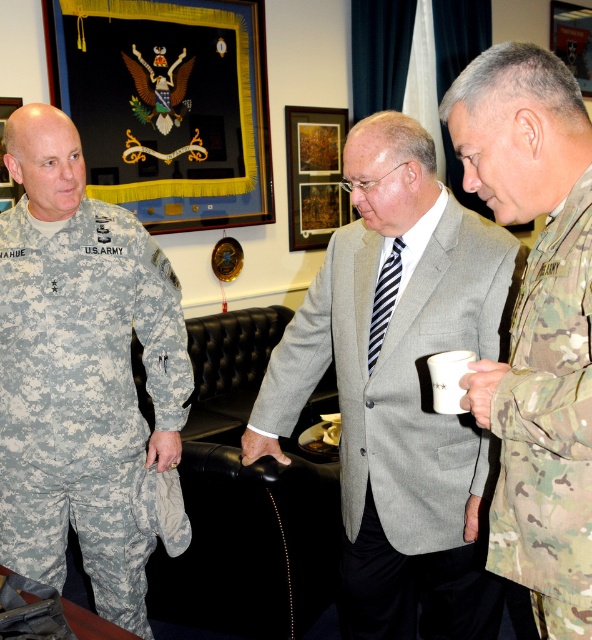
In the image of the formal meeting with a military theme, there is a point labeled as point (398, 388). Which object from the scene is located at that point?

The point (398, 388) corresponds to the gray wool suit at center.

You are an event planner arranging seating for a military awards ceremony. You need to place the gray wool suit at center and the camouflage fabric uniform at right in a way that respects their rank hierarchy. Based on their positions in the image, which one should be seated in a higher position?

The camouflage fabric uniform at right is behind the gray wool suit at center, so the gray wool suit at center should be seated in a higher position since they are positioned in front, indicating higher rank or authority.